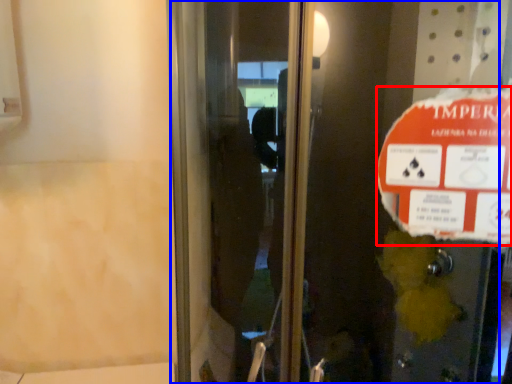
Question: Which point is closer to the camera, street sign (highlighted by a red box) or elevator door (highlighted by a blue box)?

Choices:
 (A) street sign
 (B) elevator door

Answer: (B)